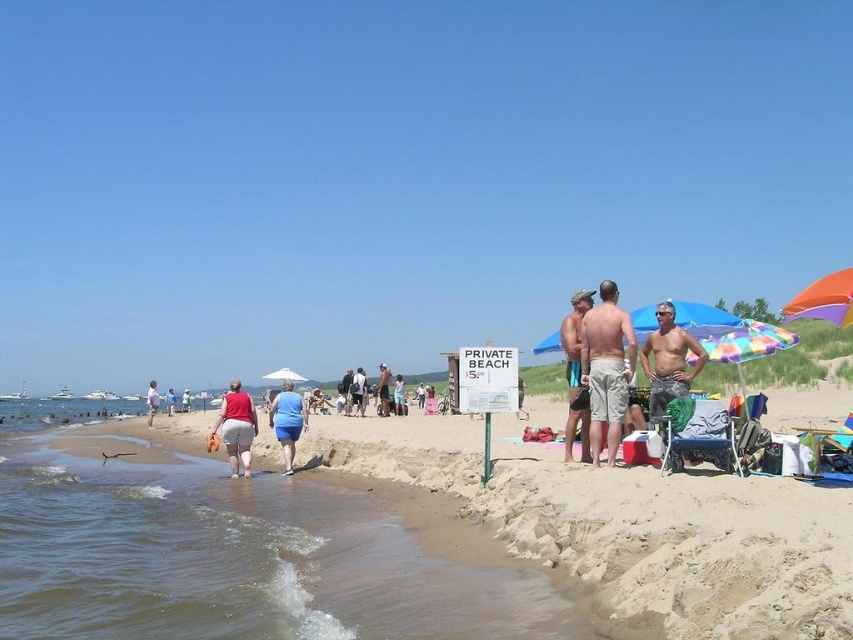
Is blue denim shorts at center taller than white fabric umbrella at center?

Yes.

Can you confirm if blue denim shorts at center is positioned to the right of white fabric umbrella at center?

Yes, blue denim shorts at center is to the right of white fabric umbrella at center.

Between point (344, 397) and point (300, 376), which one is positioned behind?

Positioned behind is point (300, 376).

Where is `blue denim shorts at center`? This screenshot has height=640, width=853. blue denim shorts at center is located at coordinates (345, 388).

Is point (244, 438) less distant than point (345, 408)?

That is True.

Between matte red shorts at lower center and blue denim shorts at center, which one has more height?

blue denim shorts at center is taller.

Is point (231, 440) closer to camera compared to point (344, 394)?

Yes, point (231, 440) is closer to viewer.

Locate an element on the screen. matte red shorts at lower center is located at coordinates (236, 428).

Does multicolored fabric umbrella at right come in front of blue cotton shorts at center?

Yes, it is.

Can you confirm if multicolored fabric umbrella at right is positioned above blue cotton shorts at center?

Yes, multicolored fabric umbrella at right is above blue cotton shorts at center.

Where is `multicolored fabric umbrella at right`? The image size is (853, 640). multicolored fabric umbrella at right is located at coordinates (824, 300).

Find the location of a particular element. The height and width of the screenshot is (640, 853). multicolored fabric umbrella at right is located at coordinates (824, 300).